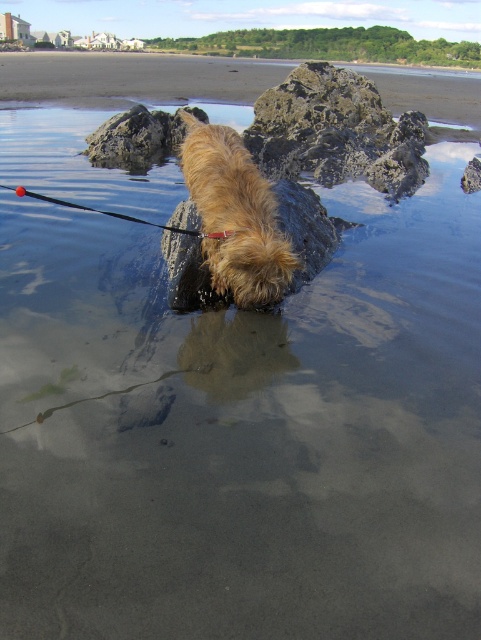
You are standing at the point marked by the coordinates point (133, 77) in the image. Looking around, you see a small, fluffy dog with light brown fur standing on a large, dark rock partially submerged in shallow water. The dog is to your left. Which direction should you walk to reach the dog?

The point (133, 77) marks the smooth sand beach at center. Since the dog is to your left, you should walk to your left to reach the dog.

You are a photographer trying to capture the fuzzy brown dog at center and the smooth sand beach at center in the same frame. Based on their positions, which one should you focus on first to ensure both are in focus?

The smooth sand beach at center is located above the fuzzy brown dog at center, so you should focus on the smooth sand beach at center first to ensure both are in focus.

You are a photographer trying to capture a photo of the fuzzy brown dog at center and the smooth sand beach at center. If you want to ensure both are in focus, how far apart are they from each other?

The smooth sand beach at center and fuzzy brown dog at center are 23.17 meters apart.